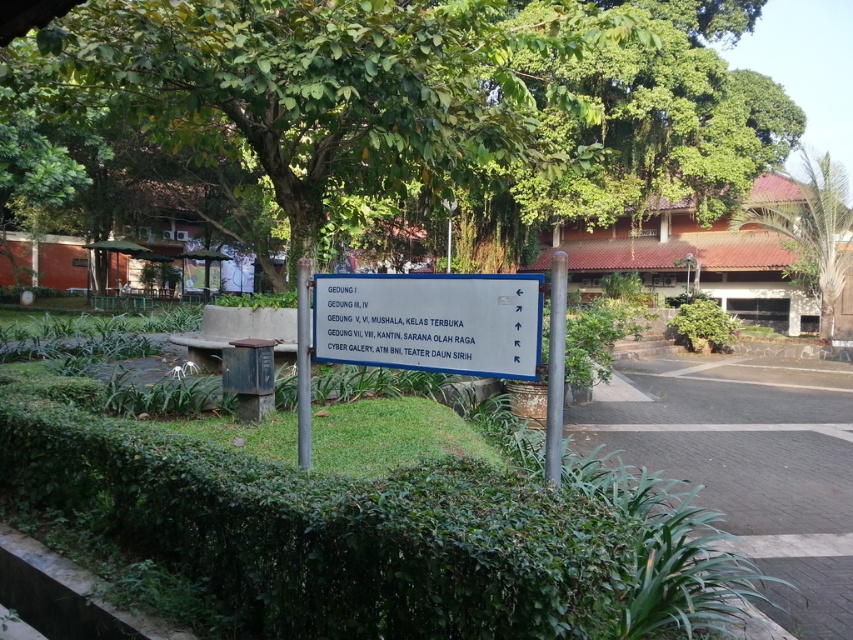
Question: Is green leafy tree at upper center to the right of green leafy palm tree at upper right from the viewer's perspective?

Choices:
 (A) no
 (B) yes

Answer: (A)

Question: Can you confirm if green leafy tree at upper center is wider than white plastic sign at center?

Choices:
 (A) no
 (B) yes

Answer: (B)

Question: Which point is closer to the camera taking this photo?

Choices:
 (A) (724, 339)
 (B) (526, 600)

Answer: (B)

Question: Which object is farther from the camera taking this photo?

Choices:
 (A) green leafy hedge at lower center
 (B) white plastic sign at center
 (C) green leafy tree at upper center
 (D) green leafy hedge at center

Answer: (D)

Question: Does white plastic sign at center appear on the left side of green leafy hedge at center?

Choices:
 (A) no
 (B) yes

Answer: (B)

Question: Among these objects, which one is nearest to the camera?

Choices:
 (A) white plastic sign at center
 (B) green leafy hedge at center
 (C) green leafy palm tree at upper right

Answer: (A)